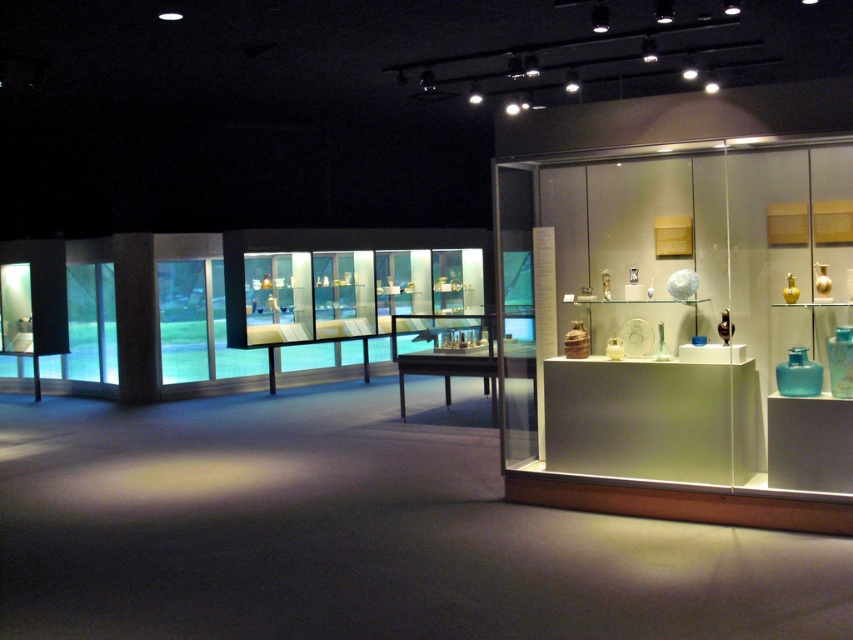
From the picture: You are standing in the museum and want to take a photo of the translucent glass display case at right without any obstructions. Based on its position, where should you stand to ensure it is centered in your camera viewfinder?

To center the translucent glass display case at right in your camera viewfinder, you should position yourself directly in front of its 2D location at point (682,330), ensuring no objects are between you and the case.